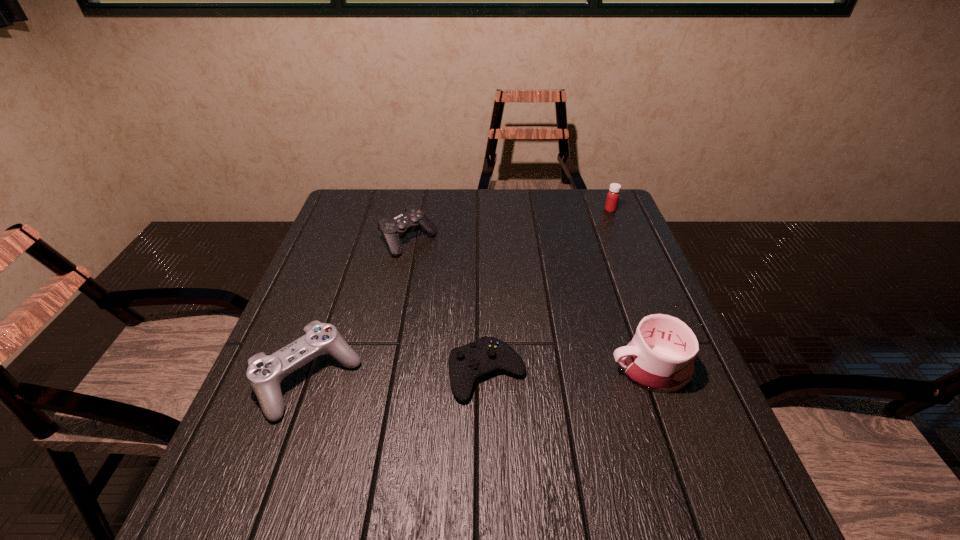
Where is `vacant space at the right edge`? The height and width of the screenshot is (540, 960). vacant space at the right edge is located at coordinates (600, 294).

Where is `blank space at the far left corner`? This screenshot has width=960, height=540. blank space at the far left corner is located at coordinates 359,197.

Identify the location of vacant space at the near left corner. (187, 538).

Locate an element on the screen. blank space at the far right corner is located at coordinates (574, 191).

Image resolution: width=960 pixels, height=540 pixels. I want to click on vacant space at the near right corner, so click(x=673, y=507).

Where is `free space between the medicine and the farthest control`? free space between the medicine and the farthest control is located at coordinates (510, 226).

Find the location of `vacant area between the shortest object and the mug`. vacant area between the shortest object and the mug is located at coordinates (568, 371).

The width and height of the screenshot is (960, 540). I want to click on free space between the mug and the farthest control, so click(x=529, y=305).

This screenshot has height=540, width=960. I want to click on free spot between the mug and the medicine, so click(630, 289).

Where is `vacant region between the medicine and the fourth nearest object`? The width and height of the screenshot is (960, 540). vacant region between the medicine and the fourth nearest object is located at coordinates (510, 226).